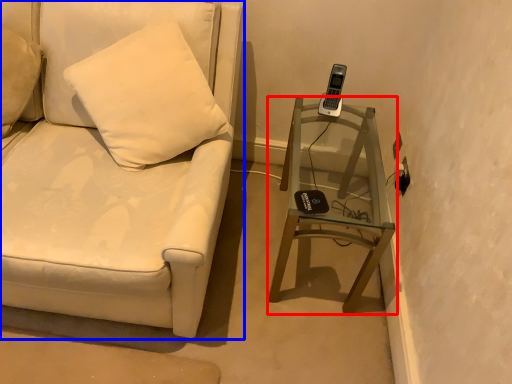
Question: Among these objects, which one is farthest to the camera, table (highlighted by a red box) or furniture (highlighted by a blue box)?

Choices:
 (A) table
 (B) furniture

Answer: (A)